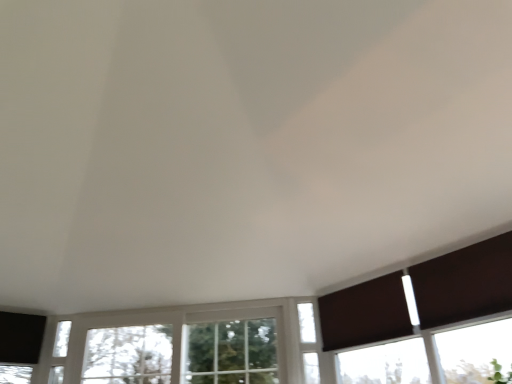
Image resolution: width=512 pixels, height=384 pixels. Identify the location of white glass window at lower left, which is the 1th window in left-to-right order. (59, 352).

The height and width of the screenshot is (384, 512). What do you see at coordinates (464, 283) in the screenshot?
I see `brown matte shutter at right` at bounding box center [464, 283].

What do you see at coordinates (188, 345) in the screenshot? Image resolution: width=512 pixels, height=384 pixels. I see `clear glass window at center, marked as the second window in a left-to-right arrangement` at bounding box center [188, 345].

Locate an element on the screen. clear glass window at center, marked as the second window in a left-to-right arrangement is located at coordinates (188, 345).

Where is `white glass window at lower left, marked as the third window in a right-to-left arrangement`? Image resolution: width=512 pixels, height=384 pixels. white glass window at lower left, marked as the third window in a right-to-left arrangement is located at coordinates (59, 352).

Is white glass window at lower left, which is the 1th window in left-to-right order, taller than brown matte shutter at right?

Yes, white glass window at lower left, which is the 1th window in left-to-right order, is taller than brown matte shutter at right.

Based on the photo, which is more to the right, white glass window at lower left, marked as the third window in a right-to-left arrangement, or brown matte shutter at right?

brown matte shutter at right.

From a real-world perspective, is white glass window at lower left, which is the 1th window in left-to-right order, physically located above or below brown matte shutter at right?

white glass window at lower left, which is the 1th window in left-to-right order, is situated lower than brown matte shutter at right in the real world.

Based on the photo, from the image's perspective, is white glass window at lower left, marked as the third window in a right-to-left arrangement, below brown matte shutter at right?

Yes, from the image's perspective, white glass window at lower left, marked as the third window in a right-to-left arrangement, is below brown matte shutter at right.

Locate an element on the screen. curtain located on the right of white glass window at lower left, marked as the third window in a right-to-left arrangement is located at coordinates (365, 313).

Looking at this image, are brown fabric curtain at lower right and white glass window at lower left, marked as the third window in a right-to-left arrangement, far apart?

Yes, brown fabric curtain at lower right and white glass window at lower left, marked as the third window in a right-to-left arrangement, are located far from each other.

In the scene shown: Can you confirm if brown fabric curtain at lower right is shorter than white glass window at lower left, which is the 1th window in left-to-right order?

→ Indeed, brown fabric curtain at lower right has a lesser height compared to white glass window at lower left, which is the 1th window in left-to-right order.

Is white glass window at lower left, which is the 1th window in left-to-right order, a part of brown fabric curtain at lower right?

No, white glass window at lower left, which is the 1th window in left-to-right order, is not inside brown fabric curtain at lower right.

Looking at this image, is white glass window at center, which appears as the first window when viewed from the right, outside of brown matte shutter at right?

That's correct, white glass window at center, which appears as the first window when viewed from the right, is outside of brown matte shutter at right.

How distant is white glass window at center, which is the 3th window in left-to-right order, from brown matte shutter at right?

1.13 meters.

Is white glass window at center, which appears as the first window when viewed from the right, touching brown matte shutter at right?

There is a gap between white glass window at center, which appears as the first window when viewed from the right, and brown matte shutter at right.

From a real-world perspective, is white glass window at center, which is the 3th window in left-to-right order, physically located above or below brown matte shutter at right?

Clearly, from a real-world perspective, white glass window at center, which is the 3th window in left-to-right order, is below brown matte shutter at right.

Looking at this image, from the image's perspective, is white glass window at center, which is the 3th window in left-to-right order, located above or below white glass window at lower left, which is the 1th window in left-to-right order?

From the image's perspective, white glass window at center, which is the 3th window in left-to-right order, appears above white glass window at lower left, which is the 1th window in left-to-right order.

Is white glass window at center, which appears as the first window when viewed from the right, oriented away from white glass window at lower left, which is the 1th window in left-to-right order?

No.

Is white glass window at center, which appears as the first window when viewed from the right, positioned beyond the bounds of white glass window at lower left, marked as the third window in a right-to-left arrangement?

Yes, white glass window at center, which appears as the first window when viewed from the right, is not within white glass window at lower left, marked as the third window in a right-to-left arrangement.

Does white glass window at center, which is the 3th window in left-to-right order, lie behind white glass window at lower left, which is the 1th window in left-to-right order?

No, it is not.

Is point (460, 297) more distant than point (323, 310)?

No.

Is the depth of brown matte shutter at right greater than that of brown fabric curtain at lower right?

No, it is in front of brown fabric curtain at lower right.

Looking at their sizes, would you say brown matte shutter at right is wider or thinner than brown fabric curtain at lower right?

Considering their sizes, brown matte shutter at right looks broader than brown fabric curtain at lower right.

Which window is the 1st one when counting from the left side of the brown fabric curtain at lower right? Please provide its 2D coordinates.

[(308, 343)]

Is brown fabric curtain at lower right taller or shorter than white glass window at center, which appears as the first window when viewed from the right?

Considering their sizes, brown fabric curtain at lower right has less height than white glass window at center, which appears as the first window when viewed from the right.

Which is more to the left, brown fabric curtain at lower right or white glass window at center, which appears as the first window when viewed from the right?

white glass window at center, which appears as the first window when viewed from the right.

Considering the sizes of objects white glass window at lower left, which is the 1th window in left-to-right order, and brown fabric curtain at lower right in the image provided, who is taller, white glass window at lower left, which is the 1th window in left-to-right order, or brown fabric curtain at lower right?

With more height is white glass window at lower left, which is the 1th window in left-to-right order.

Considering the relative positions of white glass window at lower left, which is the 1th window in left-to-right order, and brown fabric curtain at lower right in the image provided, is white glass window at lower left, which is the 1th window in left-to-right order, in front of brown fabric curtain at lower right?

That is False.

Is white glass window at lower left, which is the 1th window in left-to-right order, oriented towards brown fabric curtain at lower right?

No, white glass window at lower left, which is the 1th window in left-to-right order, does not turn towards brown fabric curtain at lower right.

The width and height of the screenshot is (512, 384). Identify the location of shutter positioned vertically above the white glass window at lower left, which is the 1th window in left-to-right order (from a real-world perspective). (464, 283).

Where is `window that is the 3rd one when counting backward from the brown fabric curtain at lower right`? The height and width of the screenshot is (384, 512). window that is the 3rd one when counting backward from the brown fabric curtain at lower right is located at coordinates (59, 352).

When comparing their distances from brown matte shutter at right, does clear glass window at center, marked as the second window in a left-to-right arrangement, or brown fabric curtain at lower right seem closer?

brown fabric curtain at lower right.

Based on their spatial positions, is clear glass window at center, marked as the second window in a left-to-right arrangement, or brown fabric curtain at lower right further from white glass window at lower left, marked as the third window in a right-to-left arrangement?

brown fabric curtain at lower right is positioned further to the anchor white glass window at lower left, marked as the third window in a right-to-left arrangement.

Considering their positions, is clear glass window at center, positioned as the second window in right-to-left order, positioned further to brown fabric curtain at lower right than brown matte shutter at right?

clear glass window at center, positioned as the second window in right-to-left order, is further to brown fabric curtain at lower right.

Which object lies nearer to the anchor point clear glass window at center, marked as the second window in a left-to-right arrangement, brown fabric curtain at lower right or white glass window at center, which appears as the first window when viewed from the right?

white glass window at center, which appears as the first window when viewed from the right, lies closer to clear glass window at center, marked as the second window in a left-to-right arrangement, than the other object.

Considering their positions, is brown fabric curtain at lower right positioned closer to clear glass window at center, positioned as the second window in right-to-left order, than brown matte shutter at right?

brown fabric curtain at lower right lies closer to clear glass window at center, positioned as the second window in right-to-left order, than the other object.

Estimate the real-world distances between objects in this image. Which object is closer to clear glass window at center, positioned as the second window in right-to-left order, white glass window at center, which is the 3th window in left-to-right order, or brown fabric curtain at lower right?

Among the two, white glass window at center, which is the 3th window in left-to-right order, is located nearer to clear glass window at center, positioned as the second window in right-to-left order.

Estimate the real-world distances between objects in this image. Which object is further from brown fabric curtain at lower right, white glass window at lower left, which is the 1th window in left-to-right order, or brown matte shutter at right?

The object further to brown fabric curtain at lower right is white glass window at lower left, which is the 1th window in left-to-right order.

Estimate the real-world distances between objects in this image. Which object is further from brown fabric curtain at lower right, white glass window at center, which appears as the first window when viewed from the right, or brown matte shutter at right?

brown matte shutter at right.

You are a GUI agent. You are given a task and a screenshot of the screen. Output one action in this format:
    pyautogui.click(x=<x>, y=<y>)
    Task: Click on the window situated between clear glass window at center, marked as the second window in a left-to-right arrangement, and brown matte shutter at right from left to right
    The image size is (512, 384).
    Given the screenshot: What is the action you would take?
    pyautogui.click(x=308, y=343)

Find the location of `window located between white glass window at lower left, which is the 1th window in left-to-right order, and white glass window at center, which is the 3th window in left-to-right order, in the left-right direction`. window located between white glass window at lower left, which is the 1th window in left-to-right order, and white glass window at center, which is the 3th window in left-to-right order, in the left-right direction is located at coordinates (188, 345).

This screenshot has width=512, height=384. Identify the location of curtain located between white glass window at lower left, marked as the third window in a right-to-left arrangement, and brown matte shutter at right in the left-right direction. (365, 313).

The height and width of the screenshot is (384, 512). What are the coordinates of `curtain between brown matte shutter at right and white glass window at center, which is the 3th window in left-to-right order, in the front-back direction` in the screenshot? It's located at (365, 313).